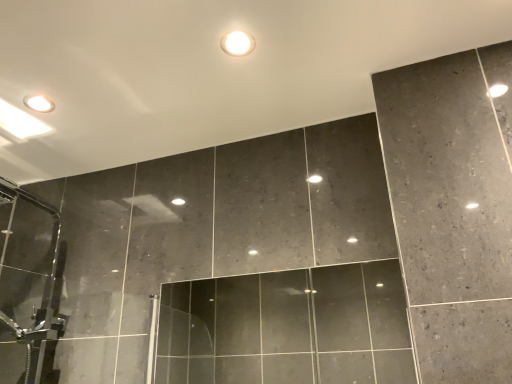
Question: Is matte white droplight at upper center wider than dark gray marble wall at upper center?

Choices:
 (A) yes
 (B) no

Answer: (B)

Question: Does matte white droplight at upper center come behind dark gray marble wall at upper center?

Choices:
 (A) yes
 (B) no

Answer: (A)

Question: Would you say matte white droplight at upper center is outside dark gray marble wall at upper center?

Choices:
 (A) no
 (B) yes

Answer: (A)

Question: Does matte white droplight at upper center appear on the left side of dark gray marble wall at upper center?

Choices:
 (A) yes
 (B) no

Answer: (B)

Question: From a real-world perspective, is matte white droplight at upper center physically above dark gray marble wall at upper center?

Choices:
 (A) yes
 (B) no

Answer: (B)

Question: From a real-world perspective, is dark gray marble wall at upper center physically located above or below transparent glass door at center?

Choices:
 (A) above
 (B) below

Answer: (A)

Question: Is dark gray marble wall at upper center to the left or to the right of transparent glass door at center in the image?

Choices:
 (A) left
 (B) right

Answer: (A)

Question: Is dark gray marble wall at upper center in front of or behind transparent glass door at center in the image?

Choices:
 (A) behind
 (B) front

Answer: (B)

Question: From the image's perspective, is dark gray marble wall at upper center located above or below transparent glass door at center?

Choices:
 (A) above
 (B) below

Answer: (A)

Question: Considering the positions of dark gray marble wall at upper center and matte white droplight at upper center in the image, is dark gray marble wall at upper center taller or shorter than matte white droplight at upper center?

Choices:
 (A) short
 (B) tall

Answer: (B)

Question: Relative to matte white droplight at upper center, is dark gray marble wall at upper center in front or behind?

Choices:
 (A) behind
 (B) front

Answer: (B)

Question: Is dark gray marble wall at upper center situated inside matte white droplight at upper center or outside?

Choices:
 (A) outside
 (B) inside

Answer: (A)

Question: Based on their sizes in the image, would you say dark gray marble wall at upper center is bigger or smaller than matte white droplight at upper center?

Choices:
 (A) small
 (B) big

Answer: (B)

Question: Is point (272, 336) positioned closer to the camera than point (252, 39)?

Choices:
 (A) farther
 (B) closer

Answer: (A)

Question: Considering the positions of transparent glass door at center and matte white droplight at upper center in the image, is transparent glass door at center taller or shorter than matte white droplight at upper center?

Choices:
 (A) tall
 (B) short

Answer: (A)